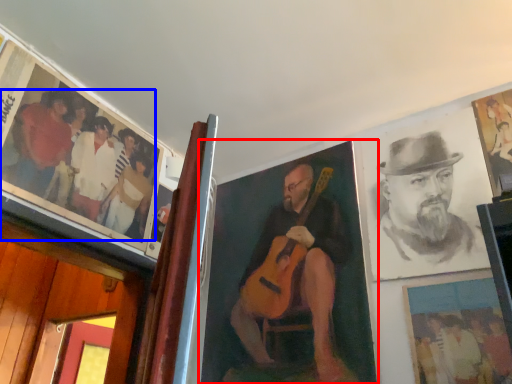
Question: Among these objects, which one is farthest to the camera, picture frame (highlighted by a red box) or person (highlighted by a blue box)?

Choices:
 (A) picture frame
 (B) person

Answer: (A)